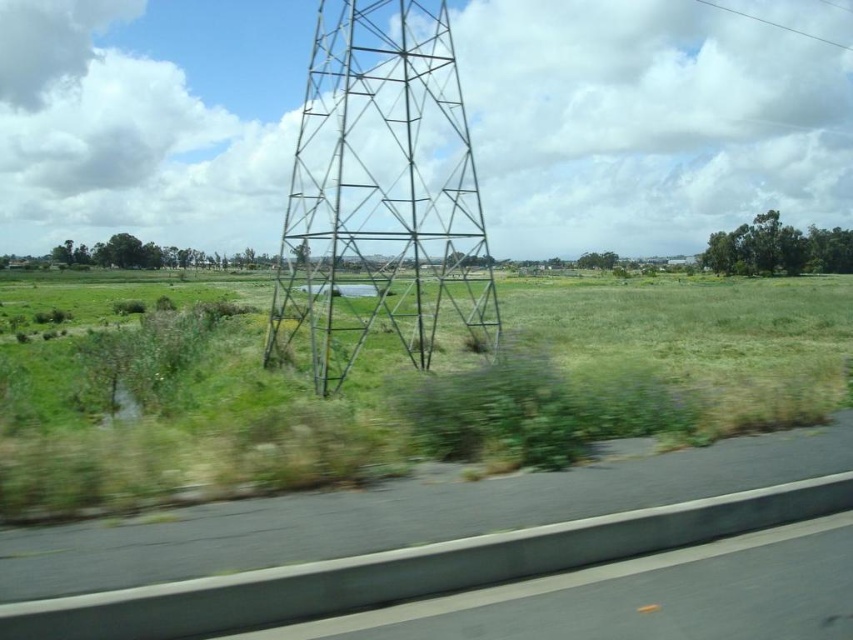
Who is more distant from viewer, [439,284] or [57,552]?

The point [439,284] is behind.

Which is more to the right, metallic grid tower at center or gray asphalt highway at lower left?

gray asphalt highway at lower left

You are a GUI agent. You are given a task and a screenshot of the screen. Output one action in this format:
    pyautogui.click(x=<x>, y=<y>)
    Task: Click on the metallic grid tower at center
    
    Given the screenshot: What is the action you would take?
    pyautogui.click(x=381, y=196)

Is gray asphalt highway at lower left positioned at the back of clear wire at upper right?

No, gray asphalt highway at lower left is in front of clear wire at upper right.

Where is `gray asphalt highway at lower left`? gray asphalt highway at lower left is located at coordinates (186, 534).

Between point (473, 248) and point (831, 42), which one is positioned in front?

Point (473, 248) is in front.

Between metallic grid tower at center and clear wire at upper right, which one is positioned lower?

metallic grid tower at center

Which is in front, point (316, 236) or point (828, 44)?

Positioned in front is point (316, 236).

The image size is (853, 640). I want to click on metallic grid tower at center, so click(381, 196).